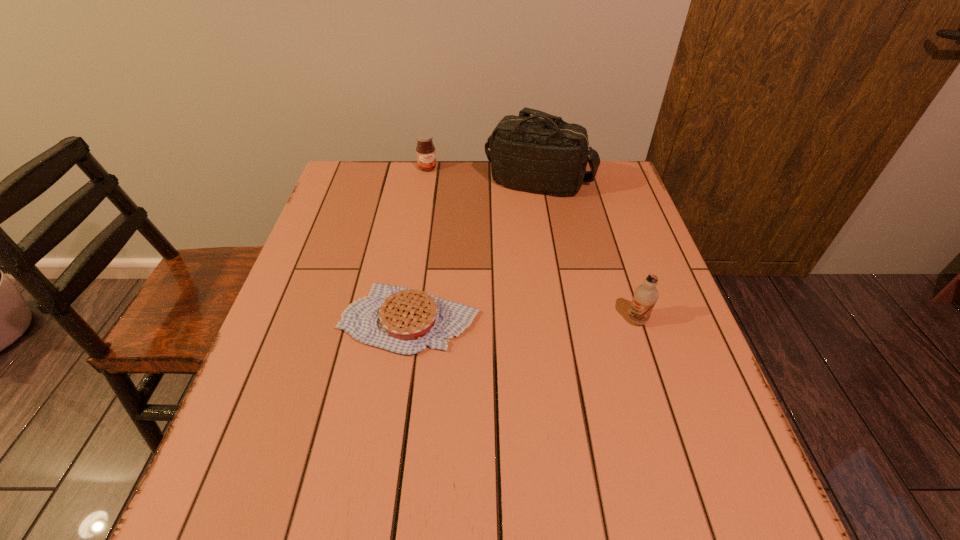
What are the coordinates of `unoccupied position between the pie and the third shortest object` in the screenshot? It's located at (523, 320).

Locate an element on the screen. empty space between the second tallest object and the third tallest object is located at coordinates (532, 244).

Image resolution: width=960 pixels, height=540 pixels. What are the coordinates of `free point between the jam and the second tallest object` in the screenshot? It's located at (532, 244).

The width and height of the screenshot is (960, 540). What are the coordinates of `object that stands as the closest to the second shortest object` in the screenshot? It's located at (549, 156).

I want to click on the second closest object to the chocolate milk, so click(x=549, y=156).

Identify the location of vacant space that satisfies the following two spatial constraints: 1. on the front side of the shortest object; 2. on the left side of the chocolate milk. (409, 320).

Where is `free point that satisfies the following two spatial constraints: 1. on the front side of the jam; 2. on the left side of the shortest object`? Image resolution: width=960 pixels, height=540 pixels. free point that satisfies the following two spatial constraints: 1. on the front side of the jam; 2. on the left side of the shortest object is located at coordinates (403, 319).

Where is `free region that satisfies the following two spatial constraints: 1. on the front side of the second tallest object; 2. on the right side of the shoulder bag`? This screenshot has height=540, width=960. free region that satisfies the following two spatial constraints: 1. on the front side of the second tallest object; 2. on the right side of the shoulder bag is located at coordinates (563, 320).

The height and width of the screenshot is (540, 960). In order to click on free location that satisfies the following two spatial constraints: 1. on the front side of the chocolate milk; 2. on the left side of the shortest object in this screenshot , I will do `click(409, 320)`.